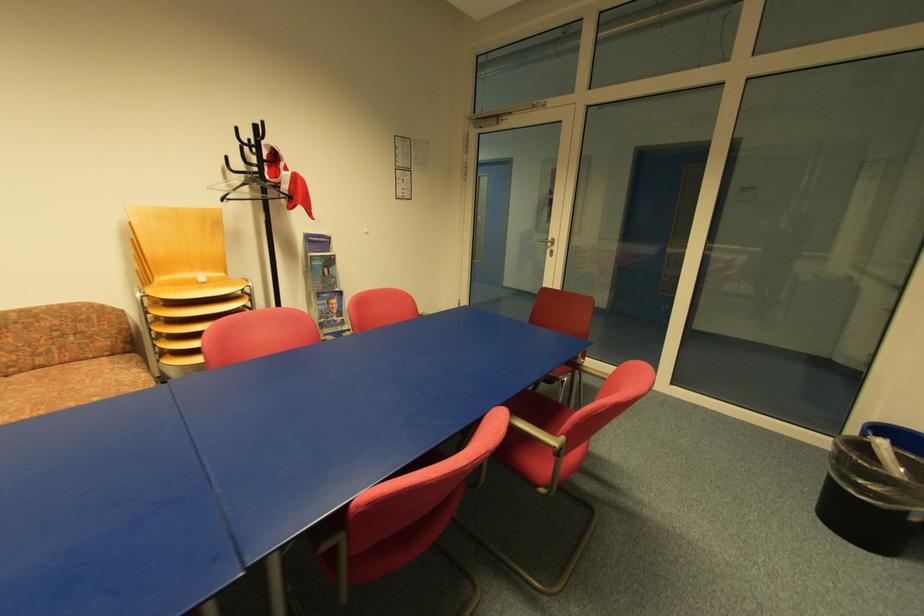
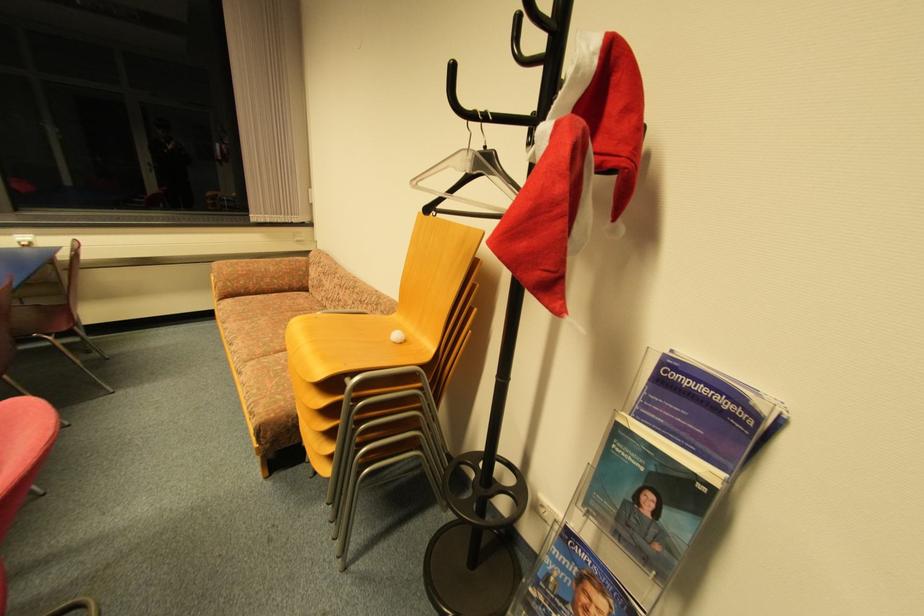
In the second image, find the point that corresponds to point 321,240 in the first image.

(708, 391)